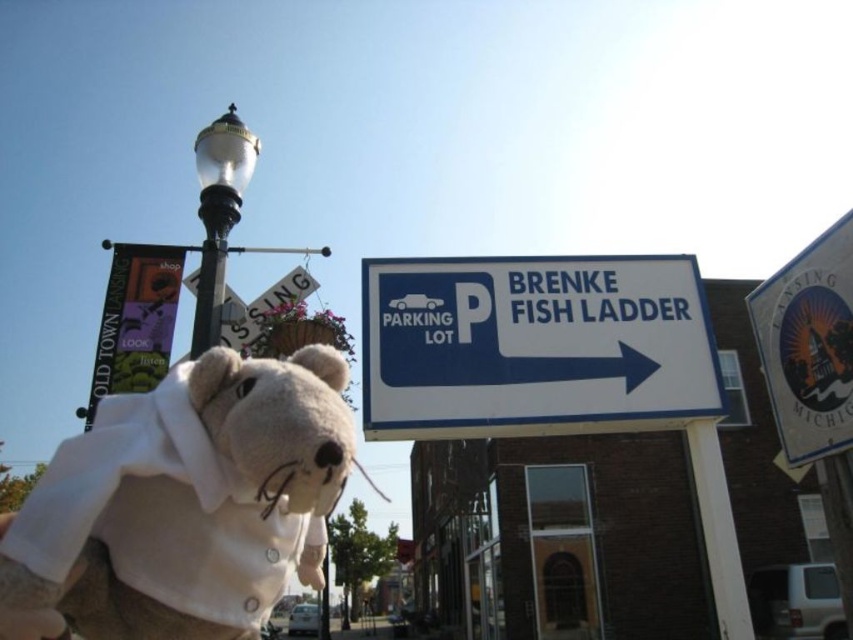
Between fluffy beige teddy bear at lower left and polished brass streetlight at upper left, which one appears on the left side from the viewer's perspective?

polished brass streetlight at upper left is more to the left.

Who is lower down, fluffy beige teddy bear at lower left or polished brass streetlight at upper left?

fluffy beige teddy bear at lower left is below.

Is point (68, 492) closer to camera compared to point (207, 333)?

Yes.

You are a GUI agent. You are given a task and a screenshot of the screen. Output one action in this format:
    pyautogui.click(x=<x>, y=<y>)
    Task: Click on the fluffy beige teddy bear at lower left
    The image size is (853, 640).
    Given the screenshot: What is the action you would take?
    [183, 502]

Can you confirm if blue plastic sign at upper right is positioned to the right of purple fabric banner at upper left?

Correct, you'll find blue plastic sign at upper right to the right of purple fabric banner at upper left.

Is blue plastic sign at upper right positioned behind purple fabric banner at upper left?

No.

Does point (827, 284) come in front of point (148, 280)?

Yes, it is.

Locate an element on the screen. This screenshot has height=640, width=853. blue plastic sign at upper right is located at coordinates (809, 346).

Can you confirm if white plastic sign at upper right is positioned below polished brass streetlight at upper left?

Indeed, white plastic sign at upper right is positioned under polished brass streetlight at upper left.

Who is more forward, (363, 396) or (244, 177)?

Positioned in front is point (363, 396).

Does point (671, 348) lie behind point (212, 310)?

Yes.

I want to click on white plastic sign at upper right, so click(x=534, y=346).